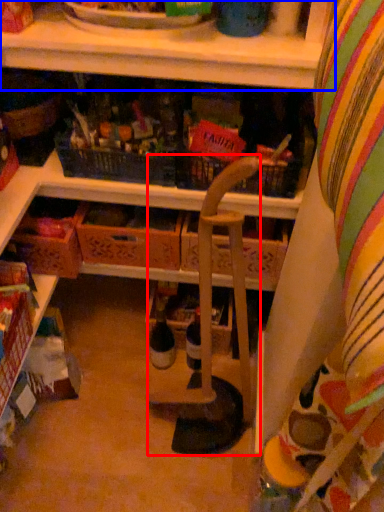
Question: Which point is closer to the camera, armchair (highlighted by a red box) or shelf (highlighted by a blue box)?

Choices:
 (A) armchair
 (B) shelf

Answer: (A)